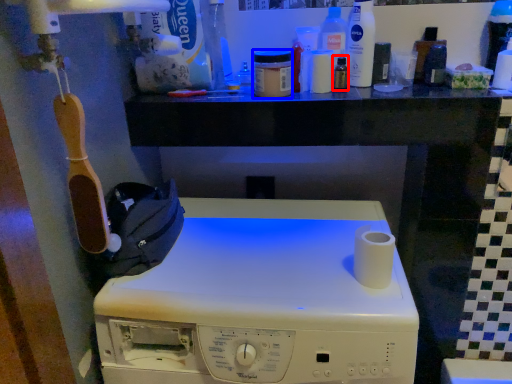
Question: Among these objects, which one is nearest to the camera, toiletry (highlighted by a red box) or toiletry (highlighted by a blue box)?

Choices:
 (A) toiletry
 (B) toiletry

Answer: (B)